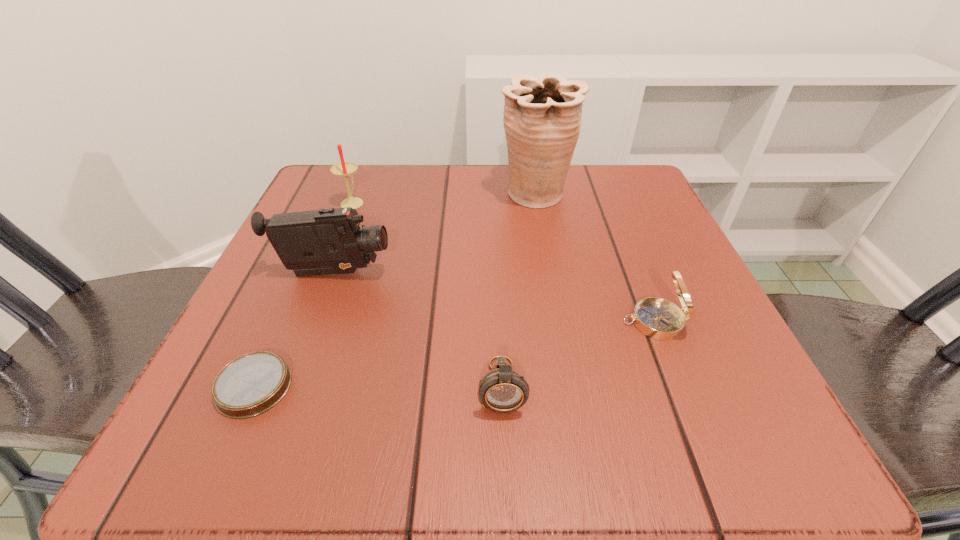
Where is `vacant region located on the front-facing side of the fourth nearest object`? vacant region located on the front-facing side of the fourth nearest object is located at coordinates (474, 274).

The image size is (960, 540). I want to click on vacant space positioned with the dial facing the fourth farthest object, so click(x=551, y=322).

I want to click on free region located with the dial facing the fourth farthest object, so click(x=373, y=322).

Locate an element on the screen. Image resolution: width=960 pixels, height=540 pixels. vacant space located with the dial facing the fourth farthest object is located at coordinates (532, 322).

This screenshot has height=540, width=960. Find the location of `vacant space situated 0.050m on the face of the second compass from right to left`. vacant space situated 0.050m on the face of the second compass from right to left is located at coordinates (505, 459).

Where is `free space located 0.190m on the right of the shortest compass`? The height and width of the screenshot is (540, 960). free space located 0.190m on the right of the shortest compass is located at coordinates (x=433, y=387).

The width and height of the screenshot is (960, 540). In order to click on urn present at the far edge in this screenshot , I will do `click(542, 116)`.

The image size is (960, 540). I want to click on candle that is at the far edge, so click(345, 169).

The image size is (960, 540). I want to click on candle located at the left edge, so click(x=345, y=169).

What are the coordinates of `camcorder located at the left edge` in the screenshot? It's located at (327, 241).